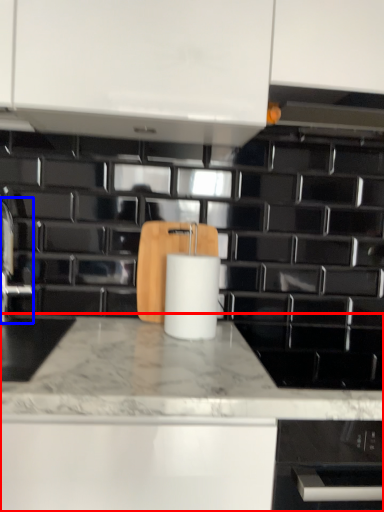
Question: Which point is further to the camera, countertop (highlighted by a red box) or faucet (highlighted by a blue box)?

Choices:
 (A) countertop
 (B) faucet

Answer: (B)